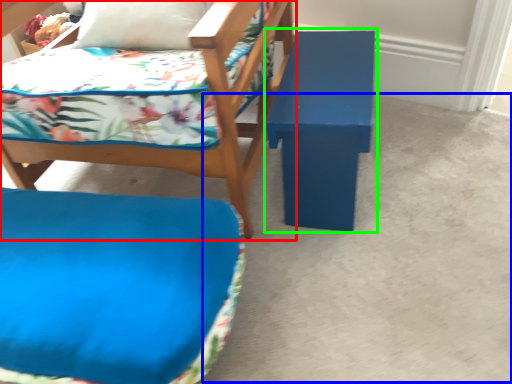
Question: Based on their relative distances, which object is nearer to chair (highlighted by a red box)? Choose from concrete (highlighted by a blue box) and table (highlighted by a green box).

Choices:
 (A) concrete
 (B) table

Answer: (B)